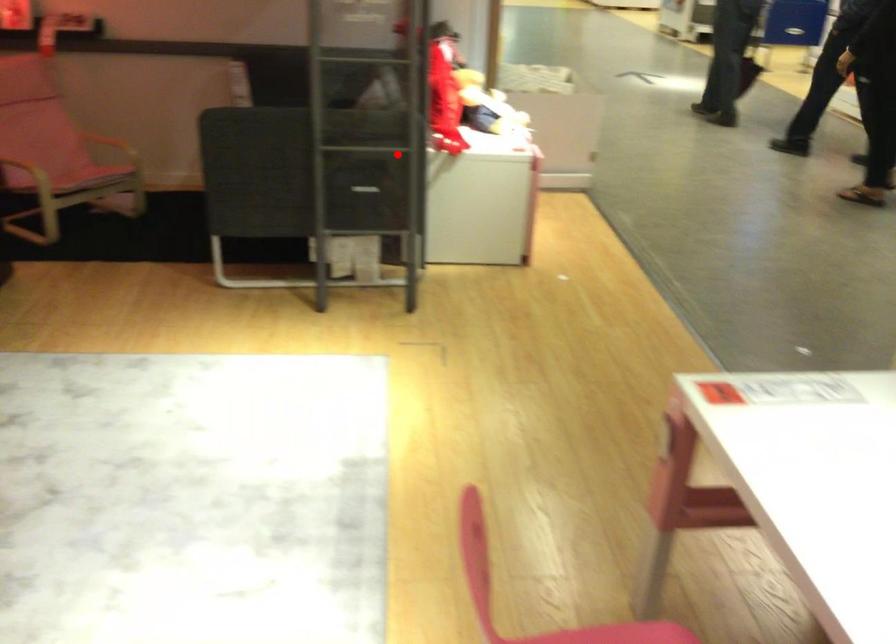
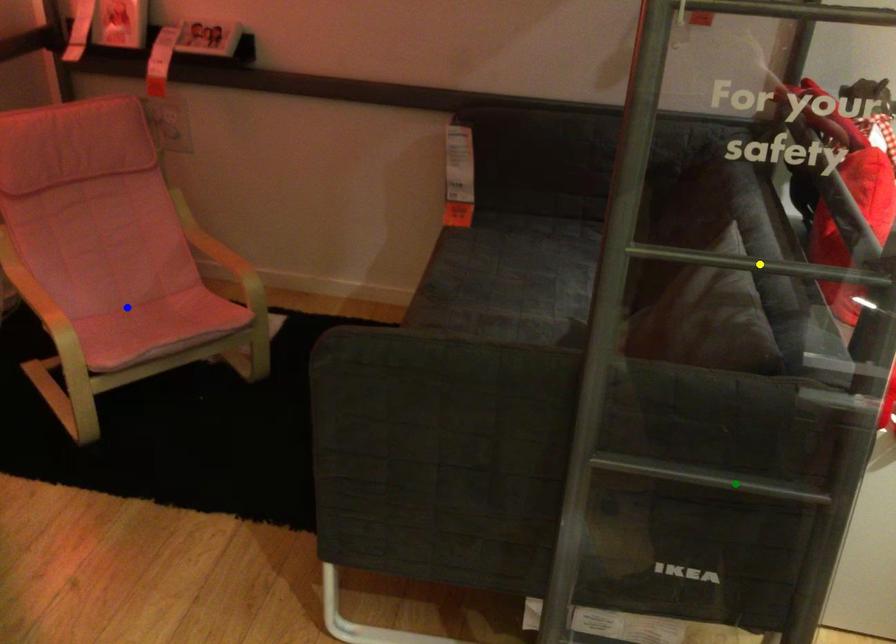
Question: I am providing you with two images of the same scene from different viewpoints. A red point is marked on the first image. You are given multiple points on the second image. Which spot in image 2 lines up with the point in image 1?

Choices:
 (A) green point
 (B) blue point
 (C) yellow point

Answer: (A)